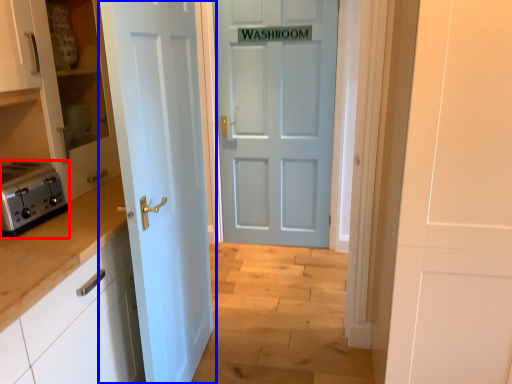
Question: Which object is closer to the camera taking this photo, toaster (highlighted by a red box) or door (highlighted by a blue box)?

Choices:
 (A) toaster
 (B) door

Answer: (B)